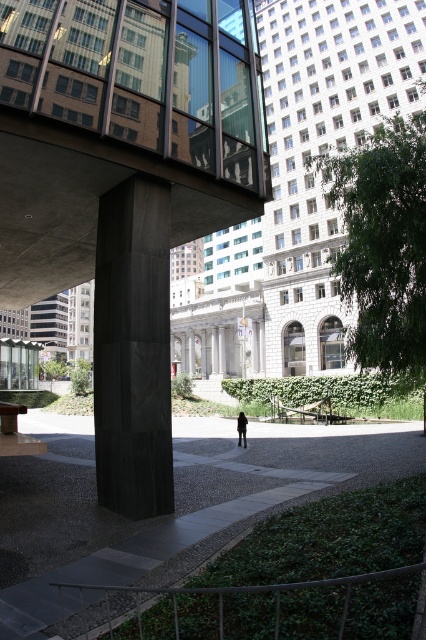
Is smooth concrete path at center above black leather jacket at center?

Indeed, smooth concrete path at center is positioned over black leather jacket at center.

Between smooth concrete path at center and black leather jacket at center, which one has more height?

smooth concrete path at center is taller.

Is point (164, 515) more distant than point (241, 442)?

No, it is not.

Locate an element on the screen. This screenshot has width=426, height=640. smooth concrete path at center is located at coordinates (175, 499).

Which is in front, point (109, 312) or point (239, 417)?

Point (109, 312)

How far apart are black polished stone column at center and black leather jacket at center?

They are 9.88 meters apart.

At what (x,y) coordinates should I click in order to perform the action: click on black polished stone column at center. Please return your answer as a coordinate pair (x, y). Image resolution: width=426 pixels, height=640 pixels. Looking at the image, I should click on (132, 349).

You are a GUI agent. You are given a task and a screenshot of the screen. Output one action in this format:
    pyautogui.click(x=<x>, y=<y>)
    Task: Click on the black polished stone column at center
    This screenshot has width=426, height=640.
    Given the screenshot: What is the action you would take?
    pyautogui.click(x=132, y=349)

Is smooth concrete path at center below black polished stone column at center?

Correct, smooth concrete path at center is located below black polished stone column at center.

Between smooth concrete path at center and black polished stone column at center, which one appears on the right side from the viewer's perspective?

smooth concrete path at center

At what (x,y) coordinates should I click in order to perform the action: click on smooth concrete path at center. Please return your answer as a coordinate pair (x, y). Looking at the image, I should click on (175, 499).